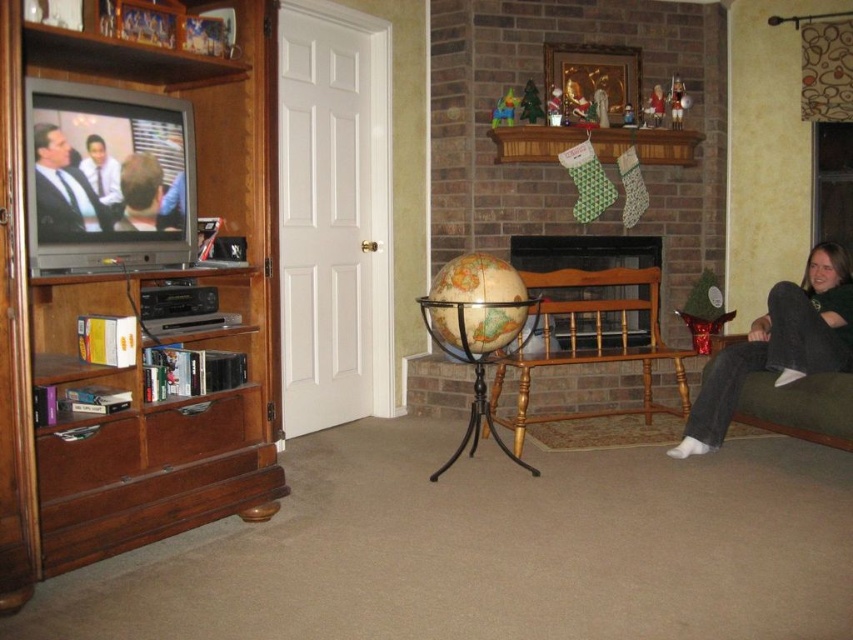
You are a guest in this living room and want to sit down. There is a wooden bench at center and a smooth skin face at left. Which one is a better option for seating?

The wooden bench at center is larger in size than the smooth skin face at left, so the wooden bench at center is a better option for seating.

You are sitting on the wooden bench at center and want to see the smooth skin face at left. Can you see it without moving your head?

Yes, because the wooden bench at center is further to the viewer than the smooth skin face at left, so the bench is closer to you, allowing you to see the face without moving your head.

You are standing at the point marked by the coordinates point (93, 157) in the living room. You want to walk to the point marked by point (613, 333). Which direction should you move to reach your destination?

Point (613, 333) is behind point (93, 157), so you should move backward to reach the destination.